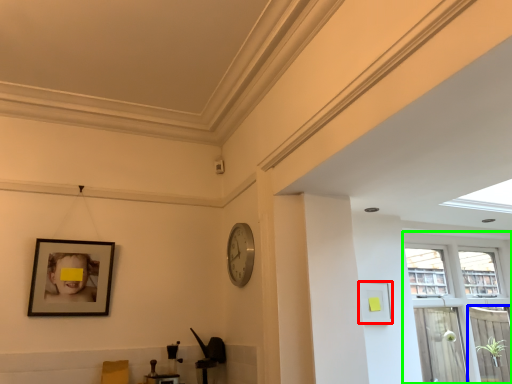
Question: Which object is the farthest from picture frame (highlighted by a red box)? Choose among these: screen door (highlighted by a blue box) or window (highlighted by a green box).

Choices:
 (A) screen door
 (B) window

Answer: (A)